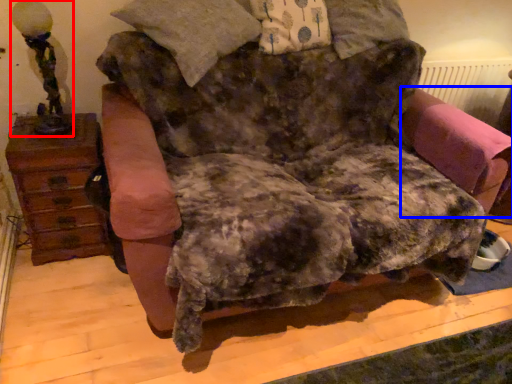
Question: Which point is closer to the camera, table lamp (highlighted by a red box) or swivel chair (highlighted by a blue box)?

Choices:
 (A) table lamp
 (B) swivel chair

Answer: (A)